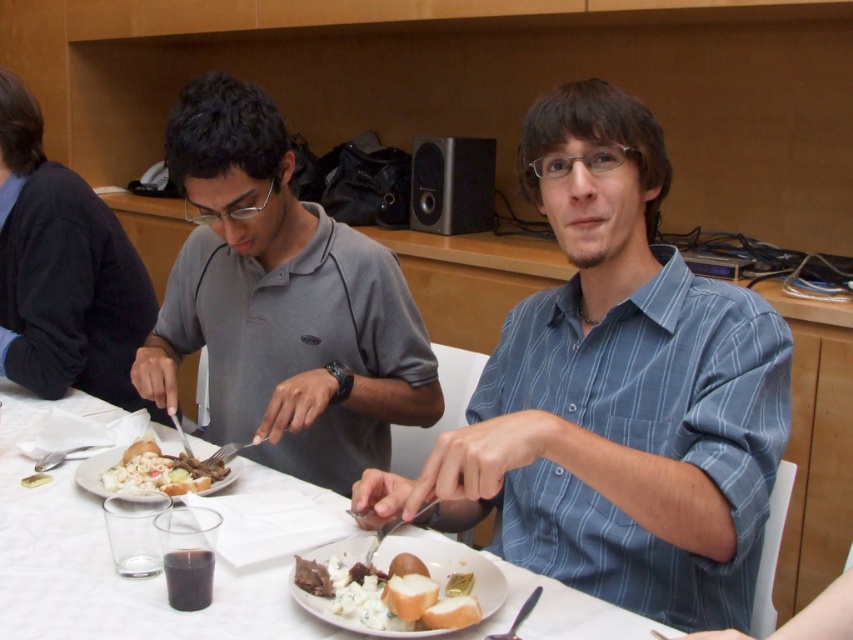
Between point (647, 337) and point (329, 481), which one is positioned behind?

The point (329, 481) is more distant.

Can you confirm if blue striped shirt at center is thinner than gray matte shirt at left?

Yes, blue striped shirt at center is thinner than gray matte shirt at left.

Is point (679, 476) farther from camera compared to point (219, 138)?

No, (679, 476) is closer to viewer.

Where is `blue striped shirt at center`? This screenshot has height=640, width=853. blue striped shirt at center is located at coordinates point(616,394).

Is white paper plate at center to the left of white creamy pasta at center from the viewer's perspective?

Indeed, white paper plate at center is positioned on the left side of white creamy pasta at center.

Does white paper plate at center lie behind white creamy pasta at center?

No, white paper plate at center is closer to the viewer.

Image resolution: width=853 pixels, height=640 pixels. What do you see at coordinates (109, 560) in the screenshot? I see `white paper plate at center` at bounding box center [109, 560].

Where is `white paper plate at center`? The width and height of the screenshot is (853, 640). white paper plate at center is located at coordinates (109, 560).

What do you see at coordinates (354, 598) in the screenshot?
I see `white bread at lower center` at bounding box center [354, 598].

Can you confirm if white bread at lower center is taller than white creamy pasta at center?

No.

Which is behind, point (309, 556) or point (131, 481)?

The point (131, 481) is more distant.

Image resolution: width=853 pixels, height=640 pixels. Identify the location of white bread at lower center. (354, 598).